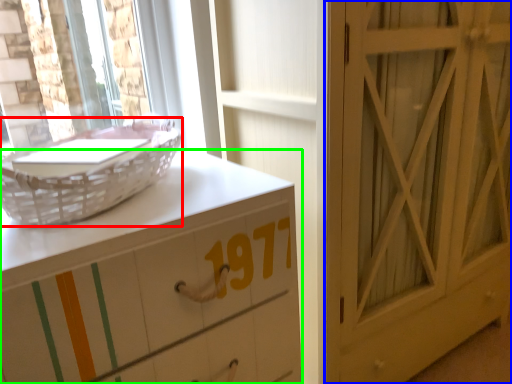
Question: Which object is positioned closest to basket (highlighted by a red box)? Select from door (highlighted by a blue box) and chest of drawers (highlighted by a green box).

Choices:
 (A) door
 (B) chest of drawers

Answer: (B)